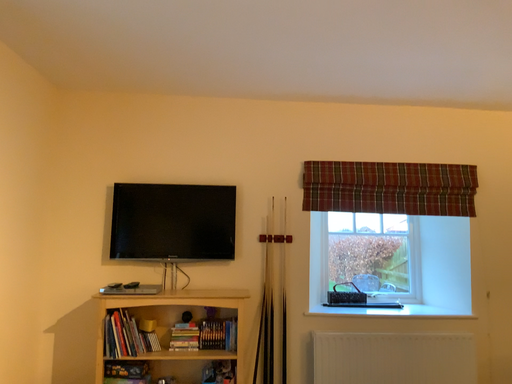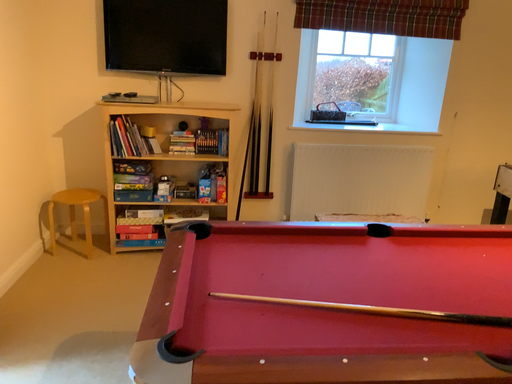
Question: How did the camera likely rotate when shooting the video?

Choices:
 (A) rotated downward
 (B) rotated upward

Answer: (A)